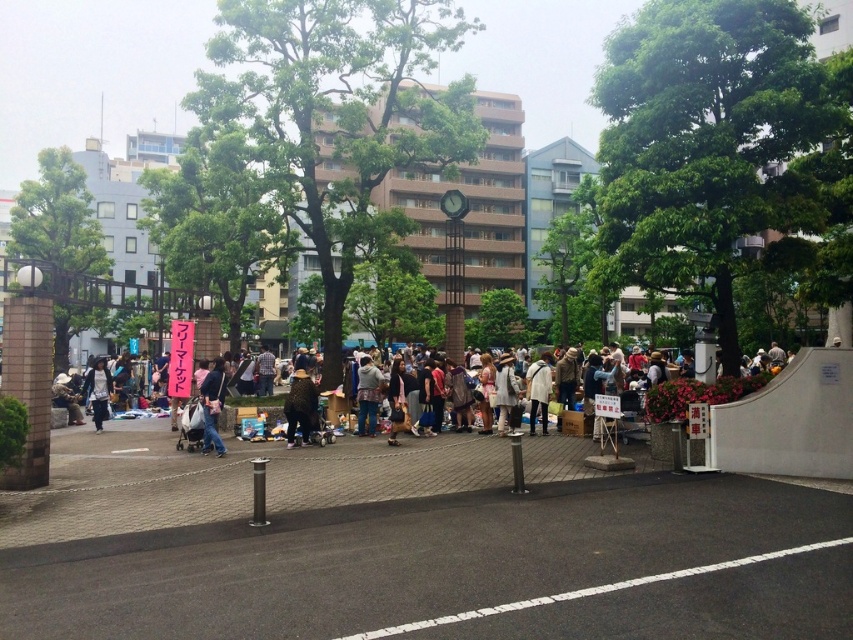
Who is shorter, leopard print coat at center or denim jacket at center?

Standing shorter between the two is denim jacket at center.

Is leopard print coat at center positioned before denim jacket at center?

Yes, it is in front of denim jacket at center.

This screenshot has height=640, width=853. Describe the element at coordinates (300, 406) in the screenshot. I see `leopard print coat at center` at that location.

Image resolution: width=853 pixels, height=640 pixels. I want to click on leopard print coat at center, so click(300, 406).

Is matte pink sign at center to the right of matte black bag at center from the viewer's perspective?

Yes, matte pink sign at center is to the right of matte black bag at center.

What do you see at coordinates (689, 396) in the screenshot?
I see `matte pink sign at center` at bounding box center [689, 396].

Locate an element on the screen. matte pink sign at center is located at coordinates (689, 396).

Does point (221, 356) come farther from viewer compared to point (370, 368)?

Yes, it is behind point (370, 368).

Measure the distance between point (x=218, y=401) and camera.

Point (x=218, y=401) and camera are 48.76 feet apart from each other.

Image resolution: width=853 pixels, height=640 pixels. What are the coordinates of `matte black bag at center` in the screenshot? It's located at (212, 406).